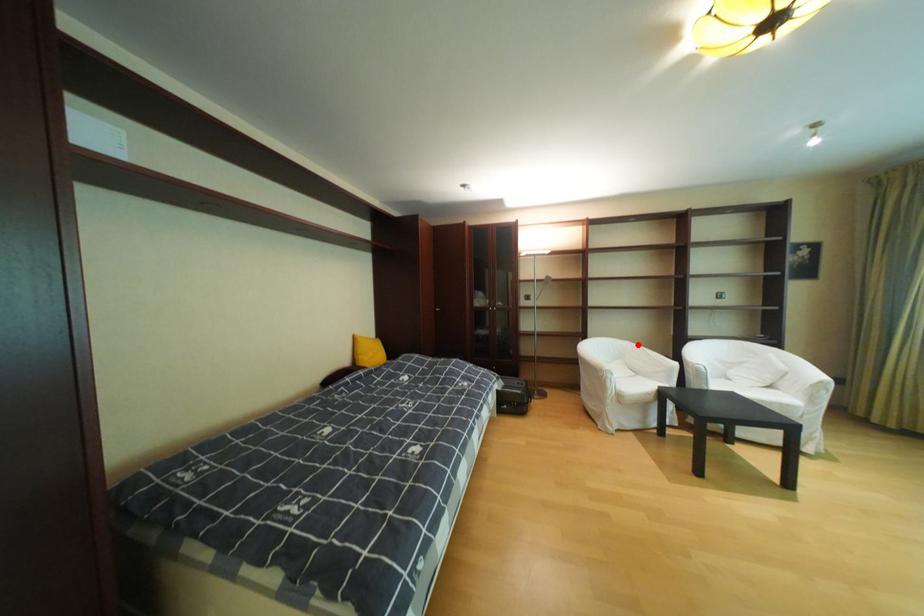
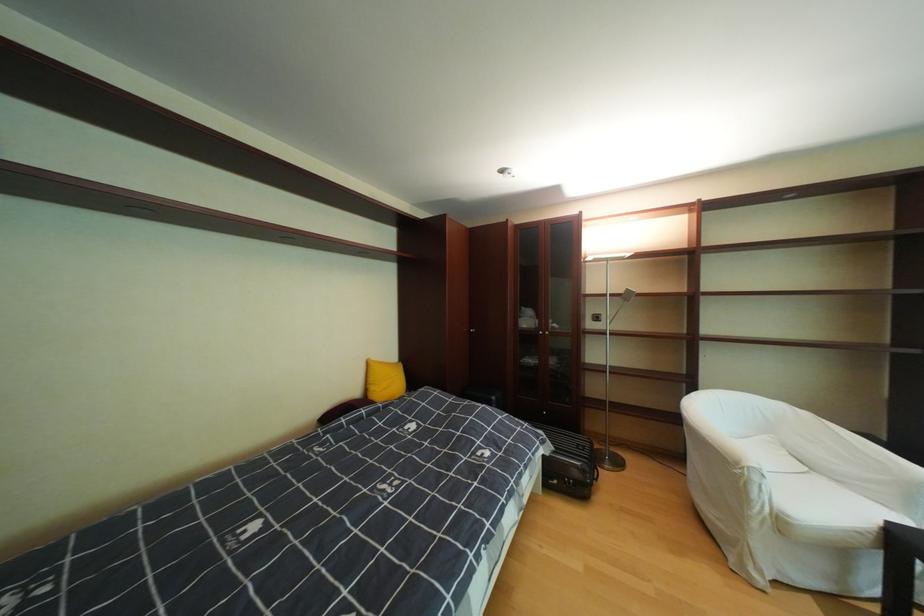
The point at the highlighted location is marked in the first image. Where is the corresponding point in the second image?

(793, 407)